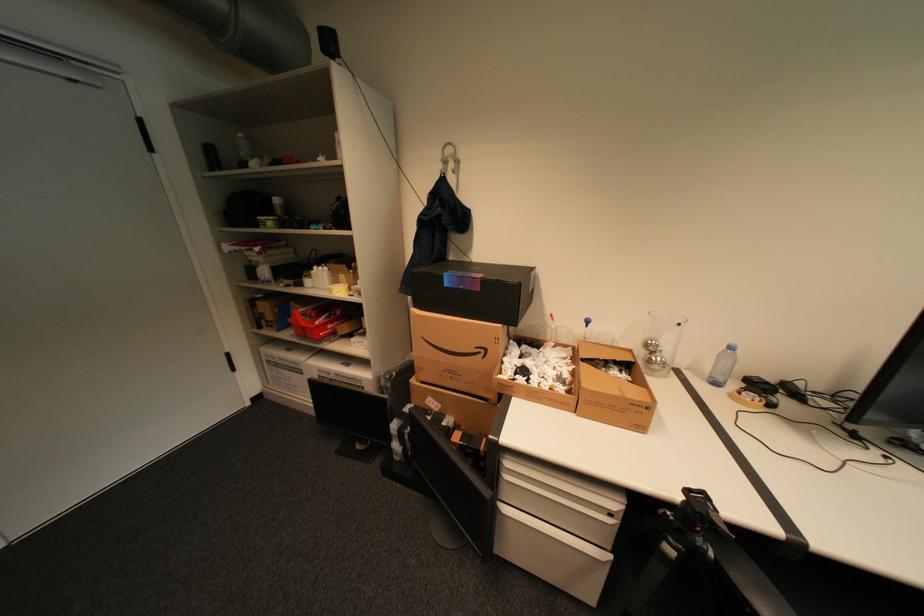
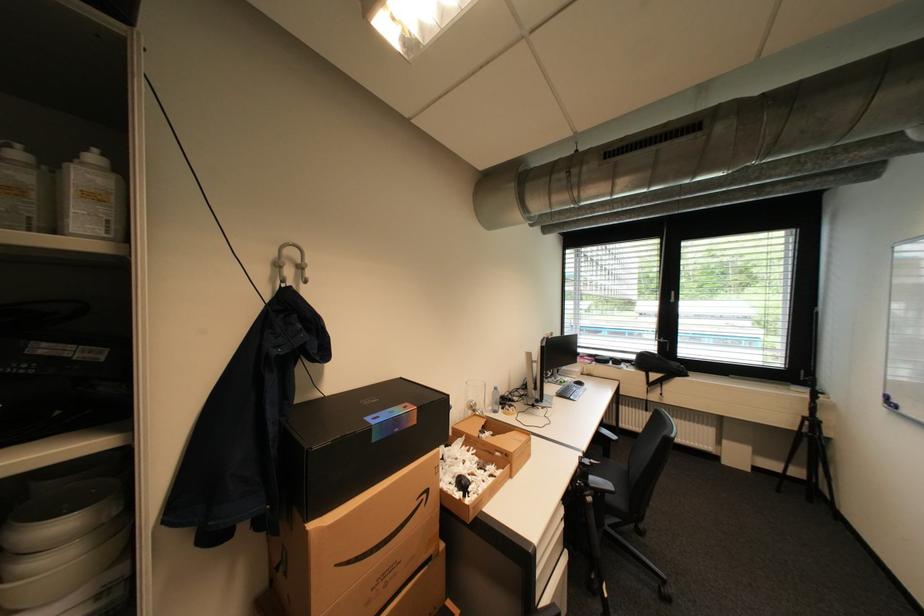
In the second image, find the point that corresponds to (x=529, y=365) in the first image.

(462, 477)